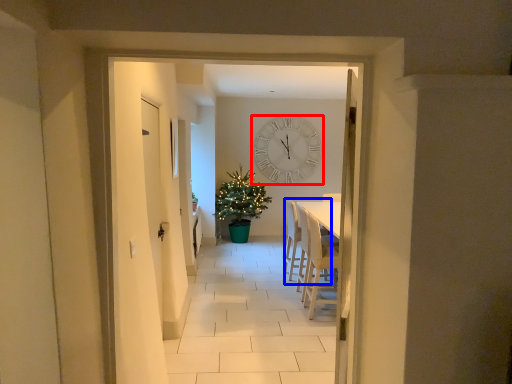
Question: Which object is further to the camera taking this photo, wall clock (highlighted by a red box) or armchair (highlighted by a blue box)?

Choices:
 (A) wall clock
 (B) armchair

Answer: (A)